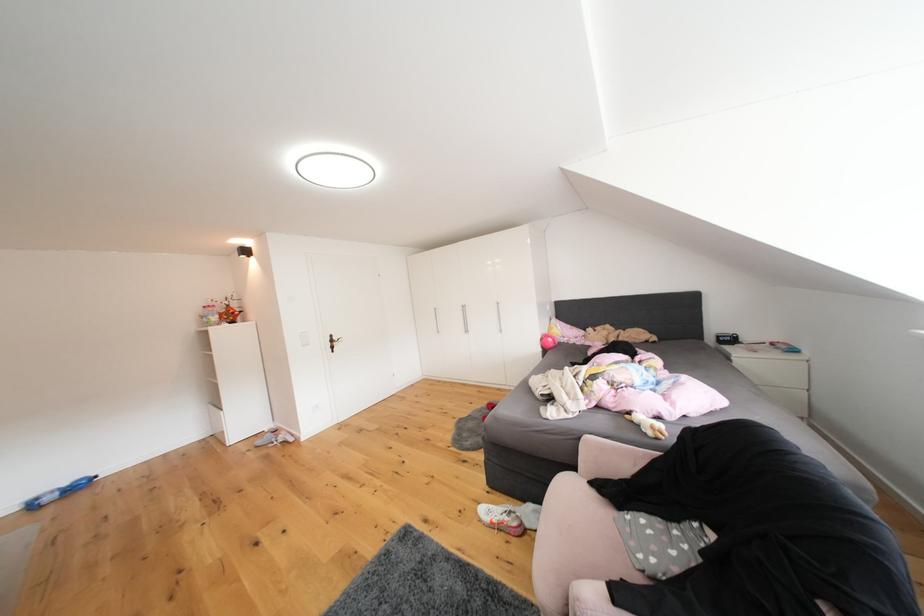
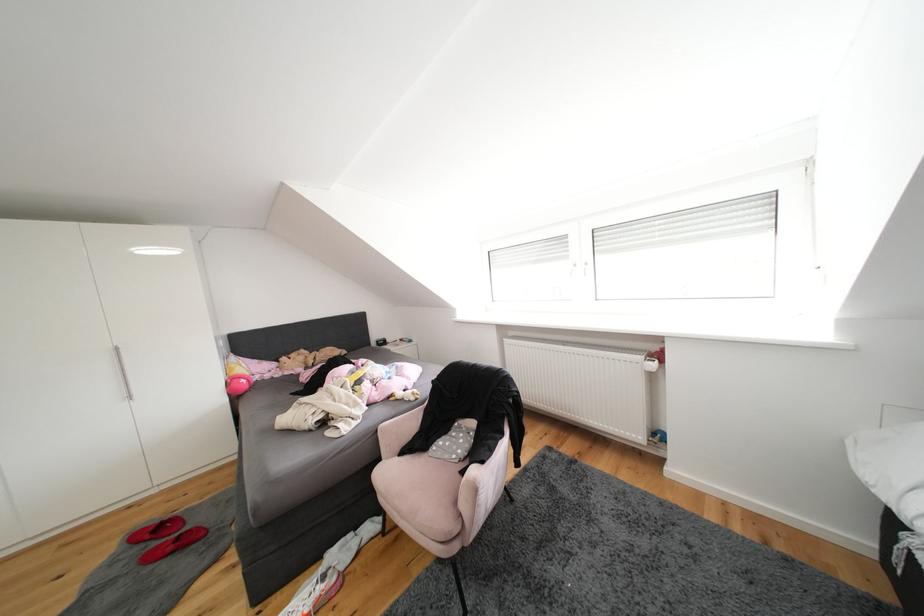
Where in the second image is the point corresponding to (x=650, y=560) from the first image?

(464, 460)